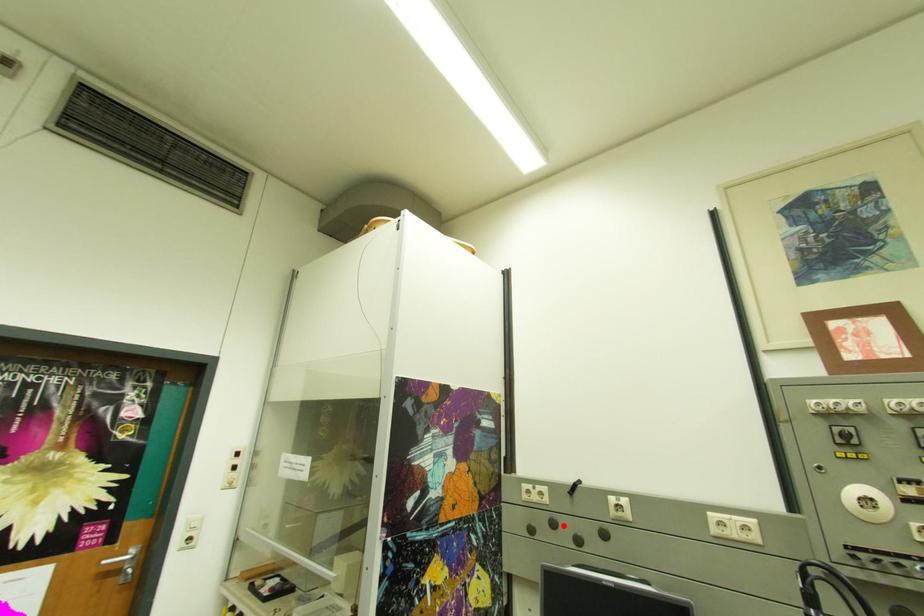
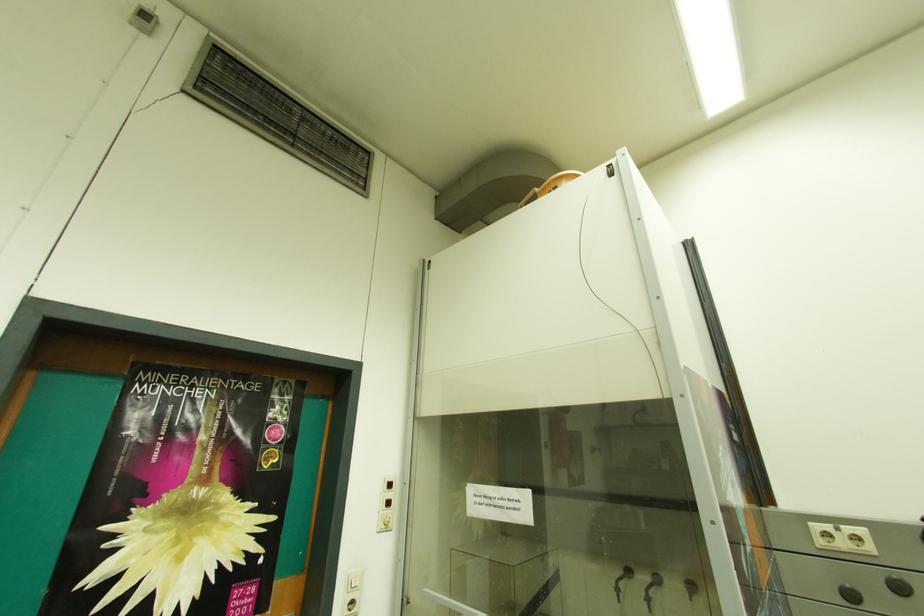
Where in the second image is the point corresponding to the highlighted location from the first image?

(910, 590)